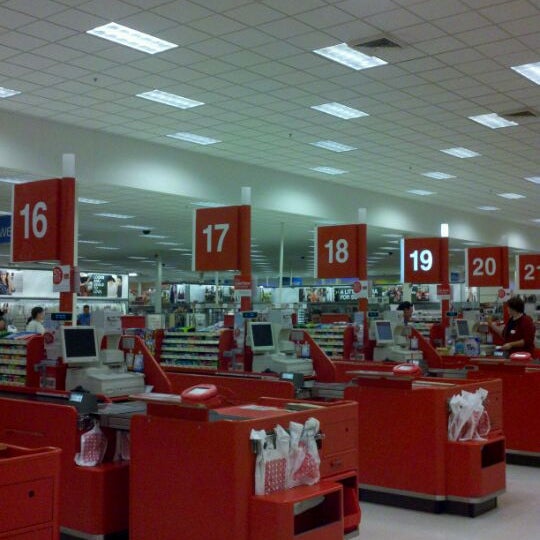
Identify the location of cash register. The image size is (540, 540). (118, 379).